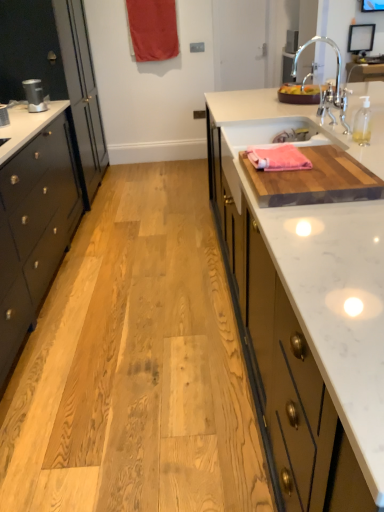
Question: Can you confirm if matte black speaker at left is positioned to the left of pink woven towel at upper right?

Choices:
 (A) yes
 (B) no

Answer: (A)

Question: Does matte black speaker at left have a lesser height compared to pink woven towel at upper right?

Choices:
 (A) yes
 (B) no

Answer: (B)

Question: Is the position of matte black speaker at left more distant than that of pink woven towel at upper right?

Choices:
 (A) yes
 (B) no

Answer: (A)

Question: Is matte black speaker at left bigger than pink woven towel at upper right?

Choices:
 (A) no
 (B) yes

Answer: (B)

Question: Is matte black speaker at left facing towards pink woven towel at upper right?

Choices:
 (A) yes
 (B) no

Answer: (A)

Question: Is matte black speaker at left to the right of pink woven towel at upper right from the viewer's perspective?

Choices:
 (A) yes
 (B) no

Answer: (B)

Question: Is pink woven towel at upper right turned away from black glossy cabinet at left?

Choices:
 (A) yes
 (B) no

Answer: (A)

Question: Is pink woven towel at upper right directly adjacent to black glossy cabinet at left?

Choices:
 (A) no
 (B) yes

Answer: (A)

Question: Does pink woven towel at upper right turn towards black glossy cabinet at left?

Choices:
 (A) yes
 (B) no

Answer: (B)

Question: Is pink woven towel at upper right closer to camera compared to black glossy cabinet at left?

Choices:
 (A) yes
 (B) no

Answer: (B)

Question: Is pink woven towel at upper right far away from black glossy cabinet at left?

Choices:
 (A) no
 (B) yes

Answer: (B)

Question: From a real-world perspective, does pink woven towel at upper right sit lower than black glossy cabinet at left?

Choices:
 (A) no
 (B) yes

Answer: (A)

Question: Considering the relative sizes of pink woven towel at upper right and matte black speaker at left in the image provided, is pink woven towel at upper right taller than matte black speaker at left?

Choices:
 (A) no
 (B) yes

Answer: (A)